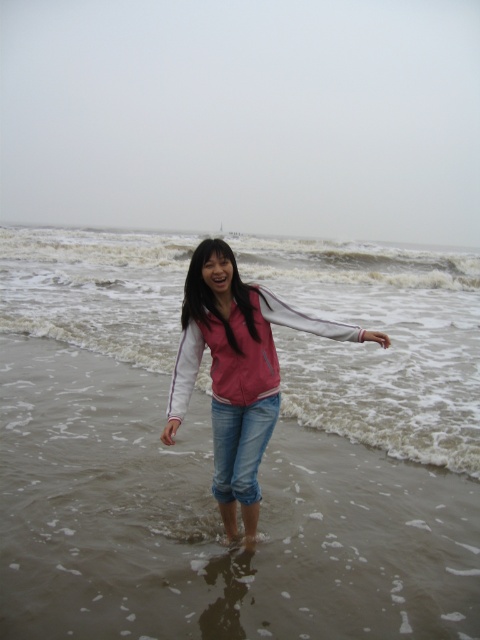
You are a lifeguard on duty at the beach. You notice a swimmer in distress at point (211, 445). According to the scene description, what is the terrain like at that point?

The point (211, 445) is on brown sandy water at center, so the terrain there is sandy water.

You are a photographer trying to capture the person in the scene. The pink fabric jacket at center and denim jeans at center are both visible. Which clothing item would appear larger in the photo if the jacket is wider than the jeans?

The pink fabric jacket at center would appear larger in the photo since it is wider than the denim jeans at center.